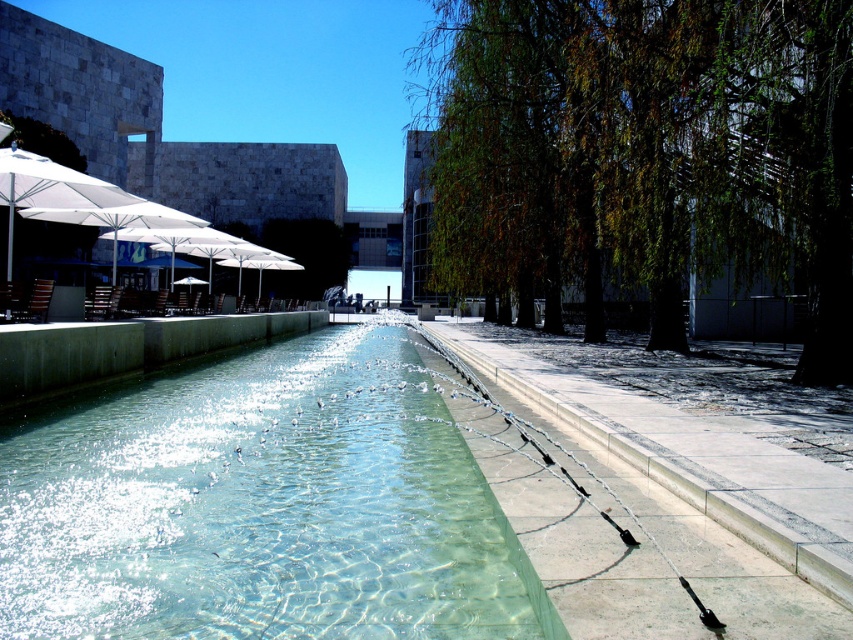
Does clear glass pool at center have a lesser height compared to white fabric umbrella at left?

Indeed, clear glass pool at center has a lesser height compared to white fabric umbrella at left.

Where is `clear glass pool at center`? clear glass pool at center is located at coordinates (260, 506).